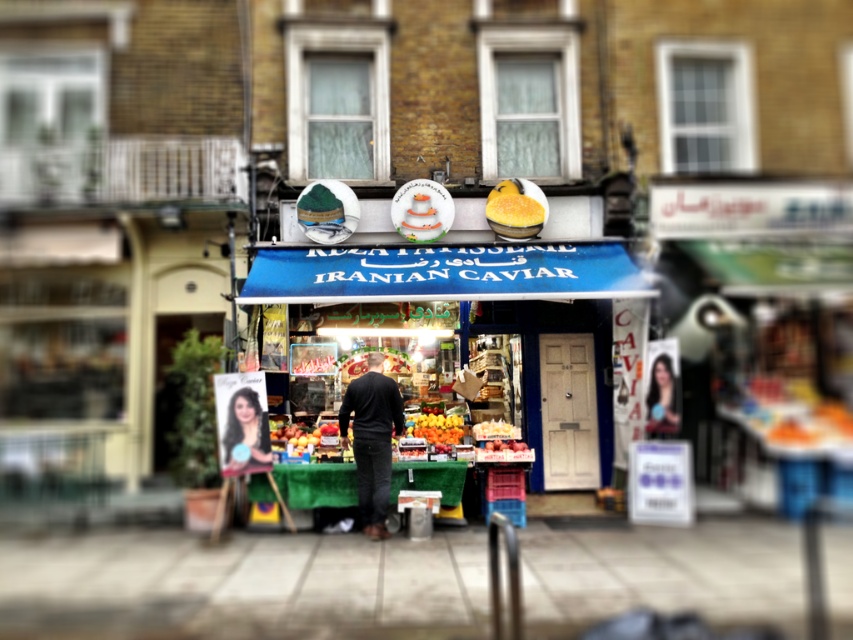
Question: Is black matte jacket at center in front of orange matte at center?

Choices:
 (A) no
 (B) yes

Answer: (B)

Question: Which point is closer to the camera?

Choices:
 (A) (370, 401)
 (B) (291, 444)
 (C) (479, 432)
 (D) (660, 417)

Answer: (A)

Question: Does black matte jacket at center lie behind smooth black hair at center?

Choices:
 (A) yes
 (B) no

Answer: (B)

Question: Is smooth black hair at center wider than orange matte at center?

Choices:
 (A) no
 (B) yes

Answer: (A)

Question: Which of the following is the closest to the observer?

Choices:
 (A) shiny red apple at center
 (B) yellow matte cake at center
 (C) smooth skin portrait at lower left
 (D) orange matte at center

Answer: (C)

Question: Among these points, which one is farthest from the camera?

Choices:
 (A) (378, 392)
 (B) (444, 419)
 (C) (520, 433)

Answer: (C)